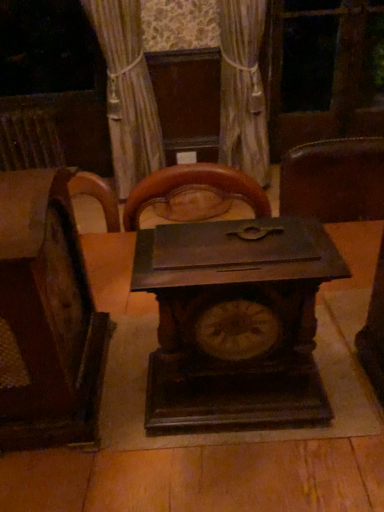
Locate an element on the screen. The width and height of the screenshot is (384, 512). free region on the left part of dark brown wood clock at center is located at coordinates coord(123,416).